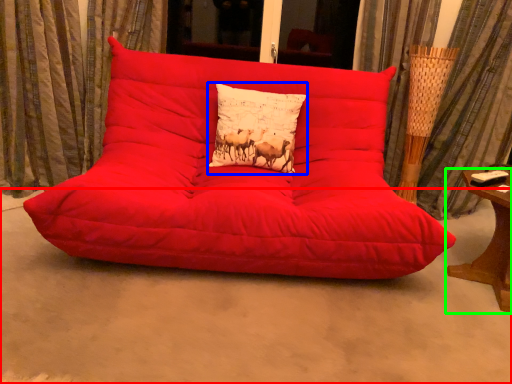
Question: Estimate the real-world distances between objects in this image. Which object is closer to concrete (highlighted by a red box), pillow (highlighted by a blue box) or table (highlighted by a green box)?

Choices:
 (A) pillow
 (B) table

Answer: (B)